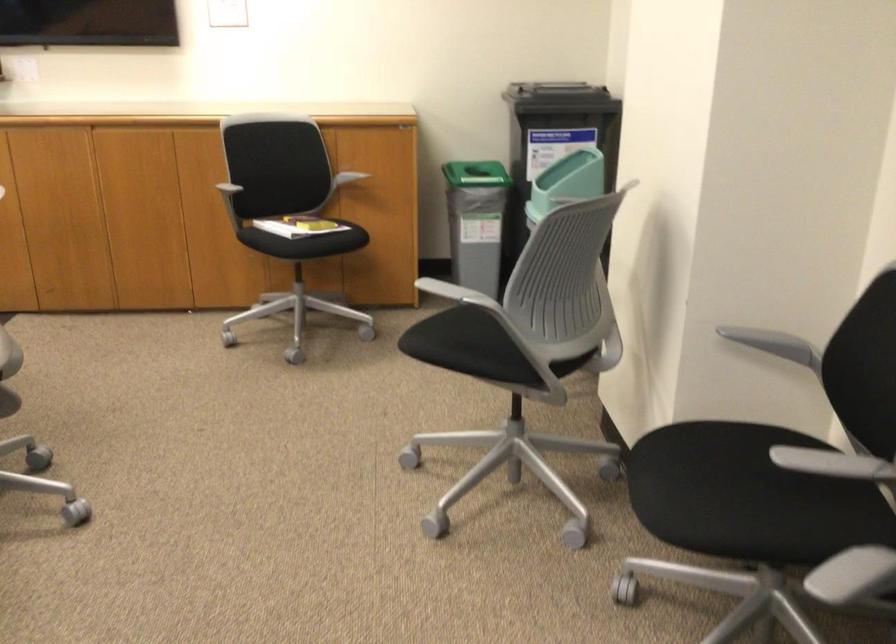
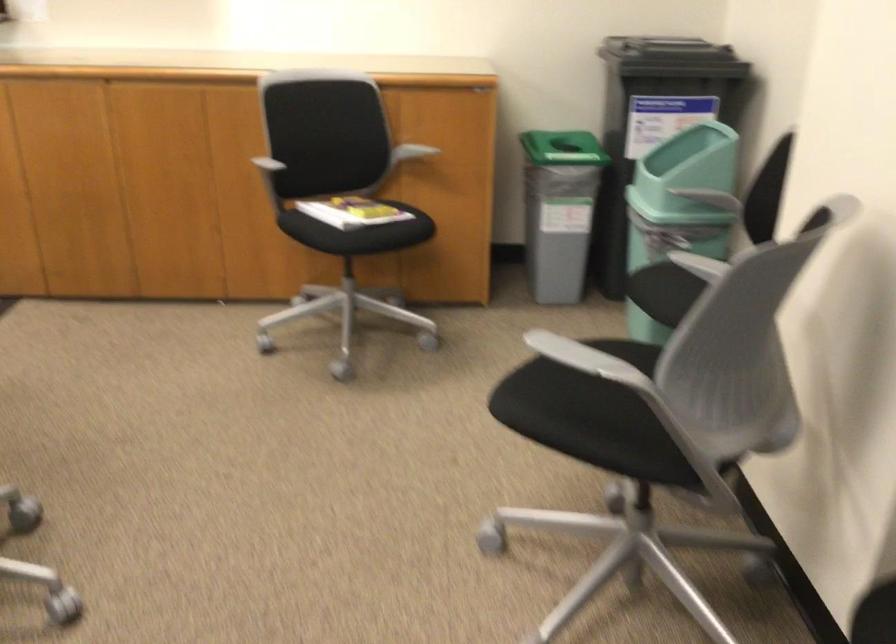
The point at (454, 292) is marked in the first image. Where is the corresponding point in the second image?

(583, 357)